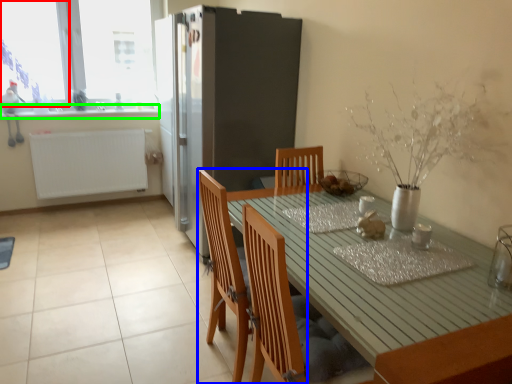
Question: Based on their relative distances, which object is farther from window screen (highlighted by a red box)? Choose from chair (highlighted by a blue box) and counter top (highlighted by a green box).

Choices:
 (A) chair
 (B) counter top

Answer: (A)